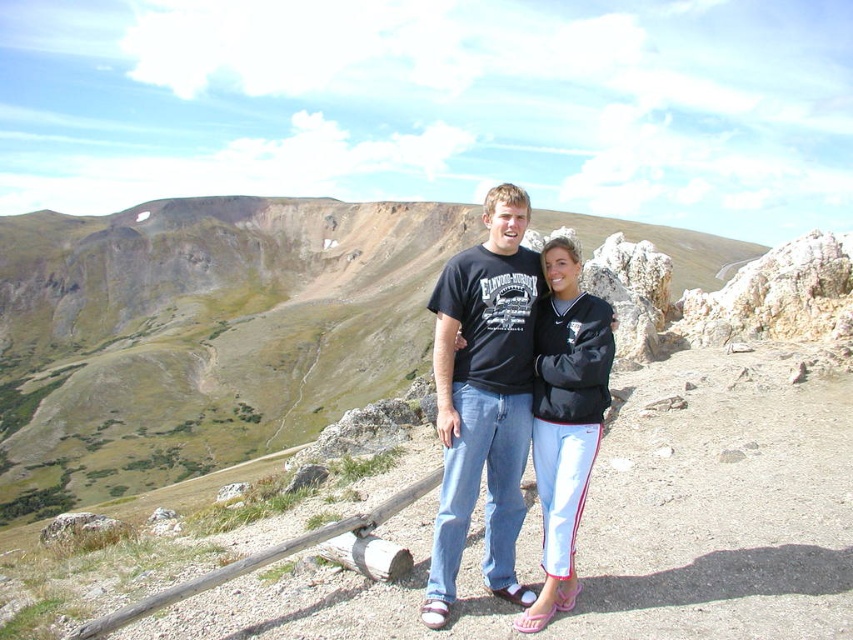
Question: From the image, what is the correct spatial relationship of rocky terrain at center in relation to matte black t-shirt at center?

Choices:
 (A) left
 (B) right

Answer: (A)

Question: Does rocky terrain at center appear on the left side of black fleece jacket at center?

Choices:
 (A) yes
 (B) no

Answer: (A)

Question: Which point is farther to the camera?

Choices:
 (A) black fleece jacket at center
 (B) rocky terrain at center
 (C) matte black t-shirt at center

Answer: (B)

Question: Can you confirm if rocky terrain at center is positioned to the left of black fleece jacket at center?

Choices:
 (A) yes
 (B) no

Answer: (A)

Question: Which of the following is the farthest from the observer?

Choices:
 (A) (270, 339)
 (B) (471, 262)

Answer: (A)

Question: Which point is closer to the camera?

Choices:
 (A) matte black t-shirt at center
 (B) black fleece jacket at center

Answer: (A)